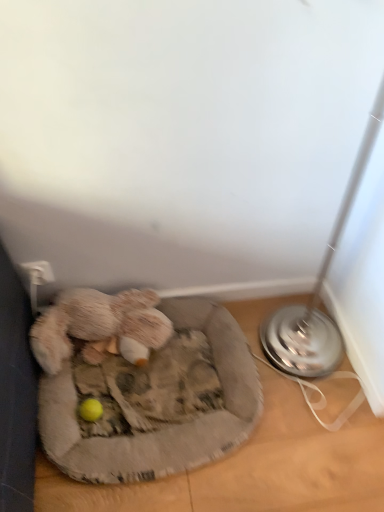
Question: In terms of height, does fuzzy beige stuffed animal at lower left look taller or shorter compared to fluffy gray dog bed at lower left?

Choices:
 (A) tall
 (B) short

Answer: (A)

Question: Considering the relative positions of fuzzy beige stuffed animal at lower left and fluffy gray dog bed at lower left in the image provided, is fuzzy beige stuffed animal at lower left to the left or to the right of fluffy gray dog bed at lower left?

Choices:
 (A) right
 (B) left

Answer: (B)

Question: Considering their positions, is fuzzy beige stuffed animal at lower left located in front of or behind fluffy gray dog bed at lower left?

Choices:
 (A) front
 (B) behind

Answer: (B)

Question: Is fluffy gray dog bed at lower left in front of or behind fuzzy beige stuffed animal at lower left in the image?

Choices:
 (A) front
 (B) behind

Answer: (A)

Question: Is fluffy gray dog bed at lower left bigger or smaller than fuzzy beige stuffed animal at lower left?

Choices:
 (A) small
 (B) big

Answer: (B)

Question: Is point (216, 384) positioned closer to the camera than point (64, 300)?

Choices:
 (A) farther
 (B) closer

Answer: (B)

Question: Do you think fluffy gray dog bed at lower left is within fuzzy beige stuffed animal at lower left, or outside of it?

Choices:
 (A) outside
 (B) inside

Answer: (A)